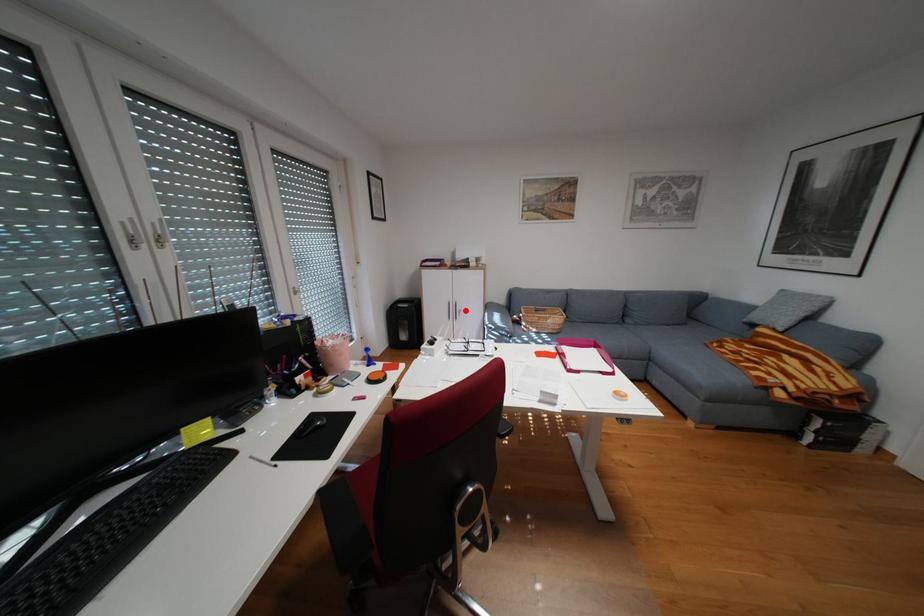
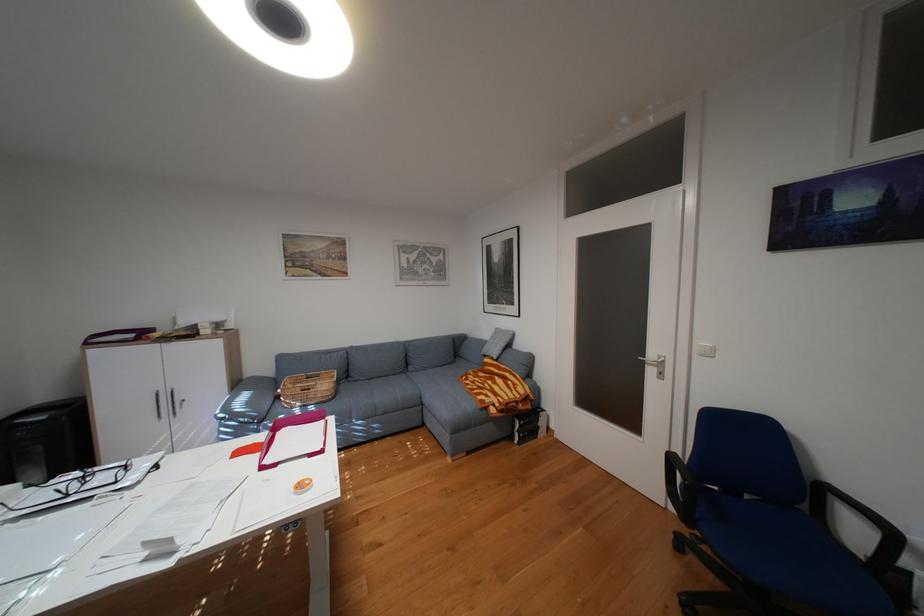
Locate, in the second image, the point that corresponds to the highlighted location in the first image.

(180, 403)